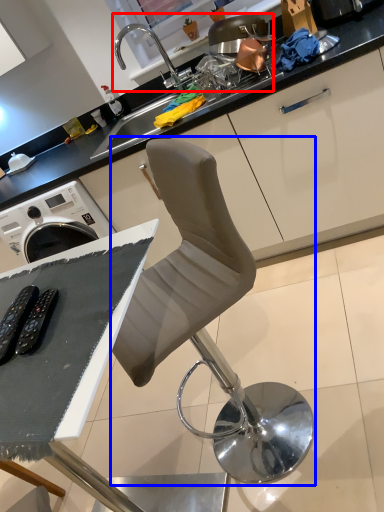
Question: Which of the following is the closest to the observer, sink (highlighted by a red box) or chair (highlighted by a blue box)?

Choices:
 (A) sink
 (B) chair

Answer: (B)